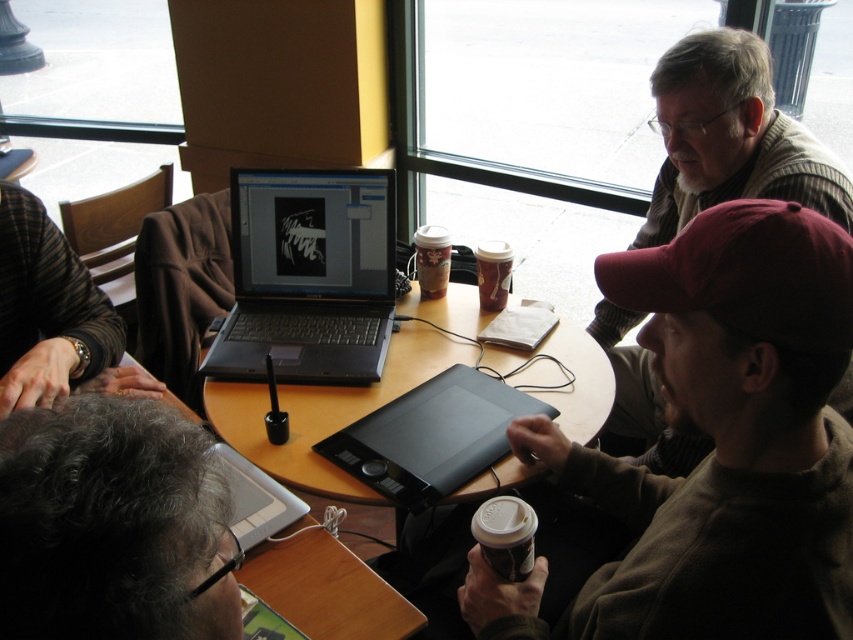
Question: Is maroon fabric cap at upper right wider than wooden table at center?

Choices:
 (A) yes
 (B) no

Answer: (B)

Question: Considering the real-world distances, which object is closest to the gray curly hair at lower left?

Choices:
 (A) brown fuzzy sweater at center
 (B) black matte graphic tablet at center
 (C) brown paper cup at center

Answer: (A)

Question: Which point appears farthest from the camera in this image?

Choices:
 (A) (525, 506)
 (B) (93, 580)
 (C) (480, 305)
 (D) (258, 189)

Answer: (C)

Question: Which object appears closest to the camera in this image?

Choices:
 (A) wooden table at center
 (B) matte plastic cup at center
 (C) black matte graphic tablet at center

Answer: (C)

Question: Observing the image, what is the correct spatial positioning of wooden table at center in reference to white paper cup at lower center?

Choices:
 (A) right
 (B) left

Answer: (B)

Question: Does maroon fabric cap at upper right appear on the left side of matte plastic cup at center?

Choices:
 (A) no
 (B) yes

Answer: (A)